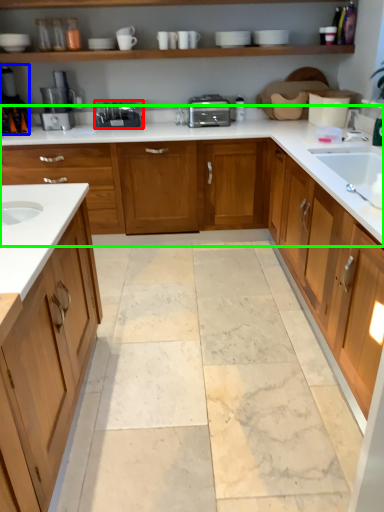
Question: Based on their relative distances, which object is nearer to appliance (highlighted by a red box)? Choose from coffee machine (highlighted by a blue box) and countertop (highlighted by a green box).

Choices:
 (A) coffee machine
 (B) countertop

Answer: (B)